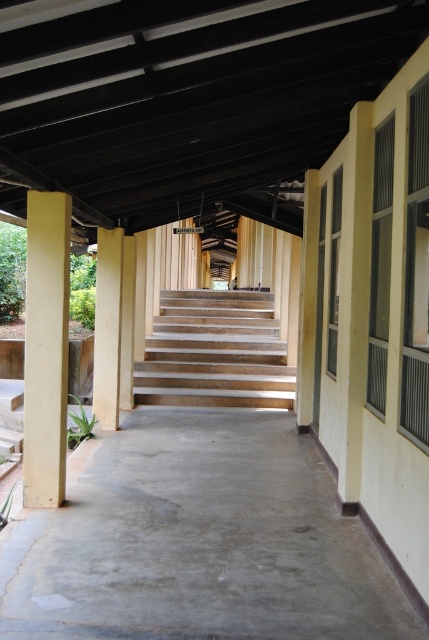
You are standing at the entrance of the corridor and want to go up the wooden stairs at center. Which direction should you walk relative to the light yellow wood pillar at center?

You should walk towards the light yellow wood pillar at center because the wooden stairs at center are located below it, so moving toward the pillar will lead you directly to the stairs.

You are standing at the entrance of the corridor and want to go up the wooden stairs at center. Which direction should you walk relative to the light yellow wood pillar at center?

You should walk to the right of the light yellow wood pillar at center because the wooden stairs at center is positioned on the right side of it.